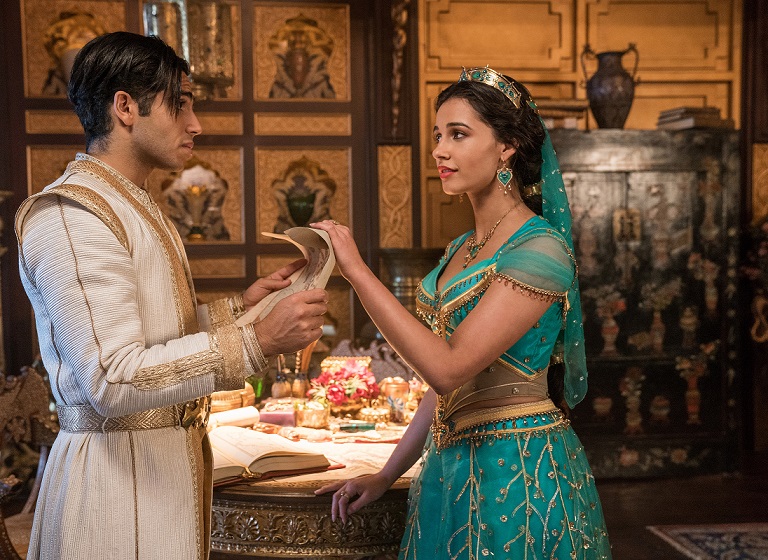
Find the location of a particular element. Image resolution: width=768 pixels, height=560 pixels. wood floor is located at coordinates (x=633, y=496).